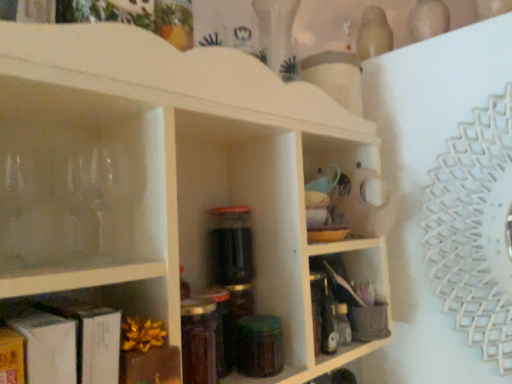
Question: Does green glass jar at center have a smaller size compared to white matte shelf at center, placed as the second shelf when sorted from front to back?

Choices:
 (A) no
 (B) yes

Answer: (B)

Question: From the image's perspective, is green glass jar at center located above white matte shelf at center, placed as the second shelf when sorted from front to back?

Choices:
 (A) yes
 (B) no

Answer: (B)

Question: Can you confirm if green glass jar at center is wider than white matte shelf at center, which is the second shelf from back to front?

Choices:
 (A) yes
 (B) no

Answer: (B)

Question: From the image's perspective, is green glass jar at center below white matte shelf at center, placed as the second shelf when sorted from front to back?

Choices:
 (A) yes
 (B) no

Answer: (A)

Question: Is green glass jar at center touching white matte shelf at center, placed as the second shelf when sorted from front to back?

Choices:
 (A) no
 (B) yes

Answer: (A)

Question: Can you confirm if green glass jar at center is shorter than white matte shelf at center, placed as the second shelf when sorted from front to back?

Choices:
 (A) no
 (B) yes

Answer: (B)

Question: Is translucent plastic bottle at center-right, the 2th bottle viewed from the front, shorter than matte brown book at lower left, acting as the first shelf starting from the front?

Choices:
 (A) yes
 (B) no

Answer: (A)

Question: Does translucent plastic bottle at center-right, the 2th bottle viewed from the front, have a greater width compared to matte brown book at lower left, acting as the first shelf starting from the front?

Choices:
 (A) no
 (B) yes

Answer: (A)

Question: From a real-world perspective, is translucent plastic bottle at center-right, placed as the 1th bottle when sorted from right to left, on top of matte brown book at lower left, acting as the first shelf starting from the front?

Choices:
 (A) no
 (B) yes

Answer: (A)

Question: Is translucent plastic bottle at center-right, positioned as the 2th bottle in left-to-right order, thinner than matte brown book at lower left, acting as the first shelf starting from the front?

Choices:
 (A) no
 (B) yes

Answer: (B)

Question: Considering the relative positions of translucent plastic bottle at center-right, positioned as the 2th bottle in left-to-right order, and matte brown book at lower left, acting as the first shelf starting from the front, in the image provided, is translucent plastic bottle at center-right, positioned as the 2th bottle in left-to-right order, to the left of matte brown book at lower left, acting as the first shelf starting from the front, from the viewer's perspective?

Choices:
 (A) yes
 (B) no

Answer: (B)

Question: Is translucent plastic bottle at center-right, the 2th bottle viewed from the front, further to camera compared to matte brown book at lower left, the third shelf viewed from the back?

Choices:
 (A) yes
 (B) no

Answer: (A)

Question: Can you confirm if translucent glass jar at center, the 1th bottle when ordered from left to right, is positioned to the right of translucent plastic bottle at center-right, positioned as the 2th bottle in left-to-right order?

Choices:
 (A) no
 (B) yes

Answer: (A)